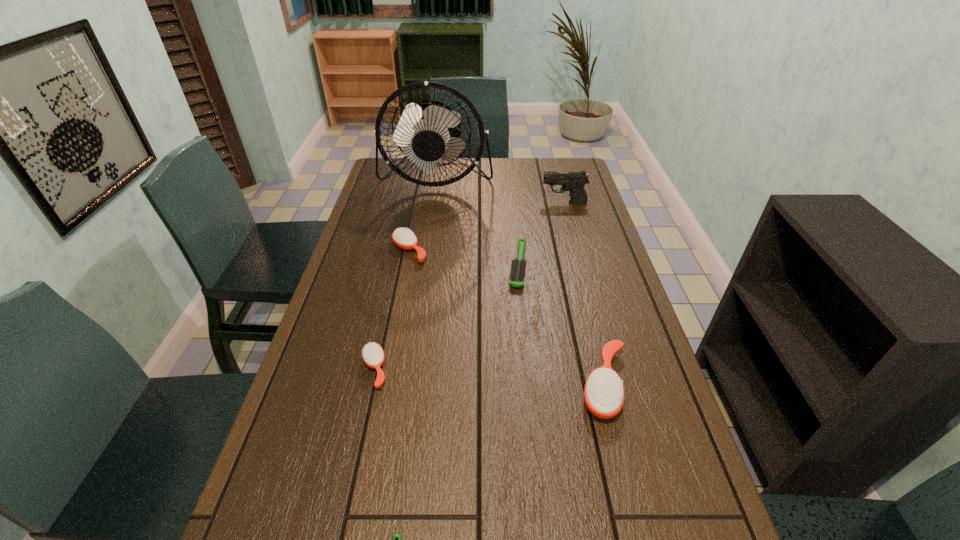
Find the location of a particular element. This screenshot has width=960, height=540. the smallest orange hairbrush is located at coordinates (373, 355).

Where is `vacant region located in front of the farthest object, directing airflow`? vacant region located in front of the farthest object, directing airflow is located at coordinates coord(428,231).

Locate an element on the screen. Image resolution: width=960 pixels, height=540 pixels. free space located 0.200m at the barrel of the pistol is located at coordinates (488, 203).

Find the location of `free location located at the barrel of the pistol`. free location located at the barrel of the pistol is located at coordinates (501, 203).

Identify the location of vacant space situated at the barrel of the pistol. This screenshot has height=540, width=960. (488, 203).

Identify the location of vacant region located on the left of the tallest hairbrush. [536, 384].

The image size is (960, 540). In order to click on vacant space located on the right of the fourth shortest hairbrush in this screenshot , I will do `click(517, 251)`.

Find the location of a particular element. The height and width of the screenshot is (540, 960). free space located 0.240m on the front of the right light hairbrush is located at coordinates (527, 355).

Find the location of a particular element. free space located on the front of the smallest orange hairbrush is located at coordinates (345, 504).

At what (x,y) coordinates should I click in order to perform the action: click on object located at the far edge. Please return your answer as a coordinate pair (x, y). The height and width of the screenshot is (540, 960). Looking at the image, I should click on (426, 132).